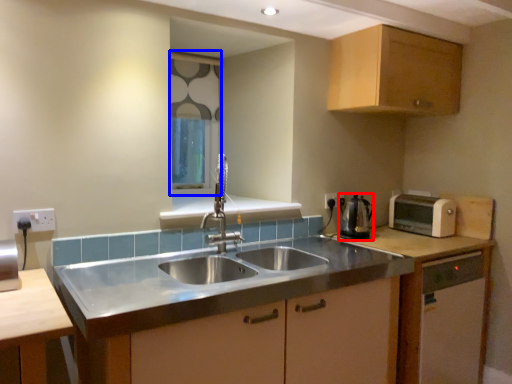
Question: Among these objects, which one is farthest to the camera, appliance (highlighted by a red box) or window screen (highlighted by a blue box)?

Choices:
 (A) appliance
 (B) window screen

Answer: (B)